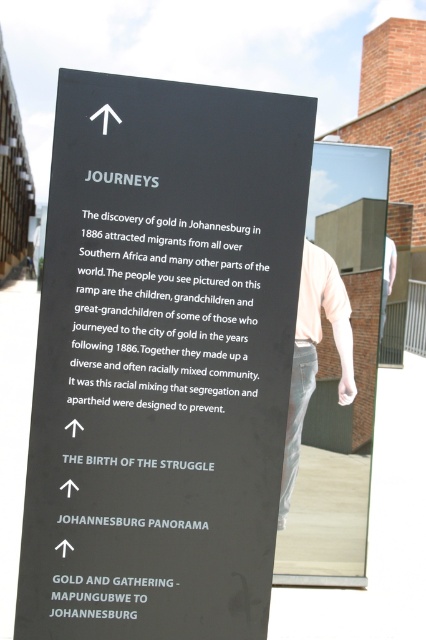
You are standing in front of the black matte sign at upper center and want to take a photo of it with your camera. The camera requires a minimum distance of 5 feet to focus properly. Can you take a clear photo from your current position?

The black matte sign at upper center and camera are 5.35 feet apart from each other, which is more than the minimum required 5 feet. Therefore, you can take a clear photo from your current position.

You are standing in front of the black matte sign at upper center and the white cotton shirt at center. Which object is larger?

The black matte sign at upper center is bigger than the white cotton shirt at center.

You are standing in front of a historical exhibit and see the black matte sign at upper center and the white cotton shirt at center. Which object is positioned higher in the image?

The black matte sign at upper center is positioned higher than the white cotton shirt at center.